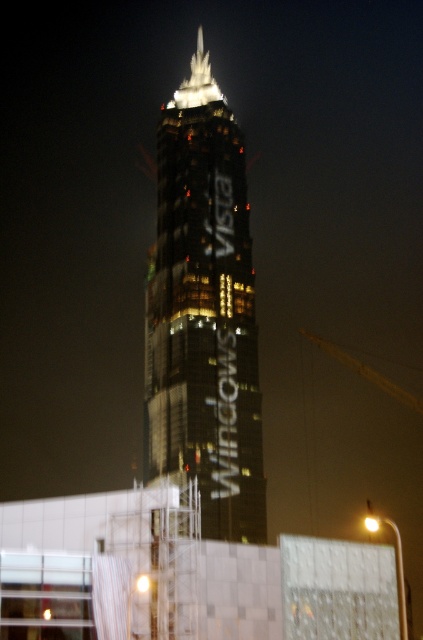
Question: Which object is positioned farthest from the wooden pole at upper center?

Choices:
 (A) reflective glass tower at center
 (B) transparent plastic scaffolding at lower center

Answer: (B)

Question: Which point is closer to the camera taking this photo?

Choices:
 (A) tap(250, 316)
 (B) tap(362, 376)

Answer: (A)

Question: Among these points, which one is farthest from the camera?

Choices:
 (A) pyautogui.click(x=95, y=608)
 (B) pyautogui.click(x=403, y=401)

Answer: (B)

Question: Can you confirm if reflective glass tower at center is positioned below wooden pole at upper center?

Choices:
 (A) no
 (B) yes

Answer: (A)

Question: Does transparent plastic scaffolding at lower center lie in front of wooden pole at upper center?

Choices:
 (A) no
 (B) yes

Answer: (B)

Question: Can you confirm if reflective glass tower at center is positioned below wooden pole at upper center?

Choices:
 (A) no
 (B) yes

Answer: (A)